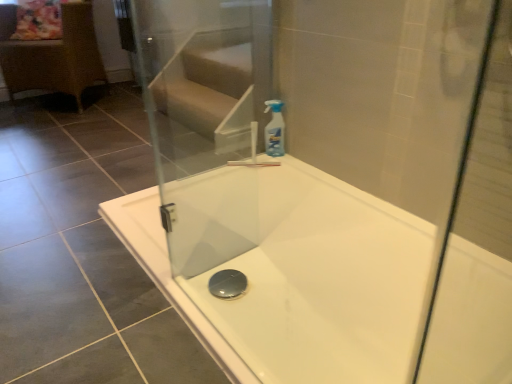
Question: Is white glossy bathtub at center positioned far away from rattan wicker chair at left?

Choices:
 (A) no
 (B) yes

Answer: (B)

Question: Considering the relative sizes of white glossy bathtub at center and rattan wicker chair at left in the image provided, is white glossy bathtub at center thinner than rattan wicker chair at left?

Choices:
 (A) yes
 (B) no

Answer: (B)

Question: Does white glossy bathtub at center lie in front of rattan wicker chair at left?

Choices:
 (A) yes
 (B) no

Answer: (A)

Question: Is white glossy bathtub at center taller than rattan wicker chair at left?

Choices:
 (A) no
 (B) yes

Answer: (A)

Question: From a real-world perspective, is white glossy bathtub at center located beneath rattan wicker chair at left?

Choices:
 (A) no
 (B) yes

Answer: (B)

Question: Which is correct: white glossy bathtub at center is inside transparent plastic spray bottle at upper right, or outside of it?

Choices:
 (A) inside
 (B) outside

Answer: (B)

Question: Is white glossy bathtub at center wider or thinner than transparent plastic spray bottle at upper right?

Choices:
 (A) thin
 (B) wide

Answer: (B)

Question: From the image's perspective, is white glossy bathtub at center located above or below transparent plastic spray bottle at upper right?

Choices:
 (A) below
 (B) above

Answer: (A)

Question: Considering the positions of white glossy bathtub at center and transparent plastic spray bottle at upper right in the image, is white glossy bathtub at center taller or shorter than transparent plastic spray bottle at upper right?

Choices:
 (A) tall
 (B) short

Answer: (B)

Question: Considering the positions of point (278, 104) and point (2, 29), is point (278, 104) closer or farther from the camera than point (2, 29)?

Choices:
 (A) closer
 (B) farther

Answer: (A)

Question: Is transparent plastic spray bottle at upper right to the left or to the right of rattan wicker chair at left in the image?

Choices:
 (A) left
 (B) right

Answer: (B)

Question: From a real-world perspective, is transparent plastic spray bottle at upper right positioned above or below rattan wicker chair at left?

Choices:
 (A) below
 (B) above

Answer: (A)

Question: Is transparent plastic spray bottle at upper right in front of or behind rattan wicker chair at left in the image?

Choices:
 (A) front
 (B) behind

Answer: (A)

Question: From the image's perspective, is white glossy bathtub at center positioned above or below transparent glass screen door at upper center?

Choices:
 (A) below
 (B) above

Answer: (A)

Question: Considering the relative positions of white glossy bathtub at center and transparent glass screen door at upper center in the image provided, is white glossy bathtub at center to the left or to the right of transparent glass screen door at upper center?

Choices:
 (A) right
 (B) left

Answer: (A)